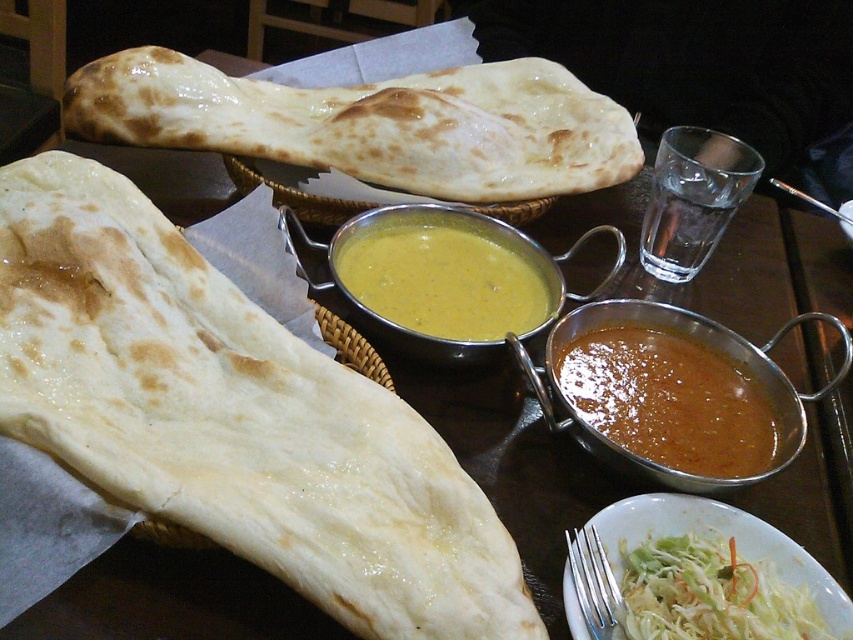
Question: Which object appears farthest from the camera in this image?

Choices:
 (A) white matte naan at left
 (B) yellow creamy soup at center
 (C) shredded white cabbage at lower right

Answer: (B)

Question: Can you confirm if yellow creamy soup at center is positioned below shredded white cabbage at lower right?

Choices:
 (A) no
 (B) yes

Answer: (A)

Question: Can you confirm if white matte naan at left is smaller than brown matte curry at center?

Choices:
 (A) yes
 (B) no

Answer: (B)

Question: Which is farther from the brown matte curry at center?

Choices:
 (A) shredded white cabbage at lower right
 (B) white matte naan at upper center
 (C) white matte naan at left

Answer: (B)

Question: From the image, what is the correct spatial relationship of white matte naan at left in relation to shredded white cabbage at lower right?

Choices:
 (A) below
 (B) above

Answer: (B)

Question: Which of the following is the farthest from the observer?

Choices:
 (A) white matte naan at upper center
 (B) brown matte curry at center

Answer: (A)